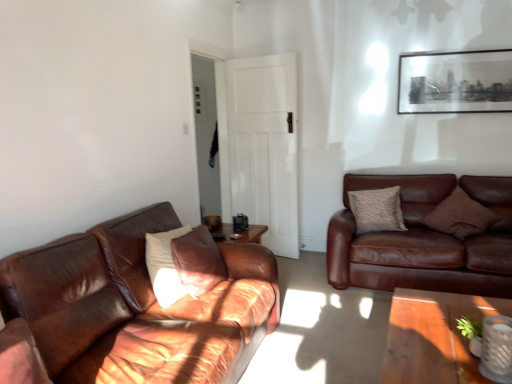
Question: Can you confirm if white matte pillow at left, the 1th pillow when ordered from front to back, is taller than white matte door at center?

Choices:
 (A) no
 (B) yes

Answer: (A)

Question: Can you confirm if white matte pillow at left, the 1th pillow when ordered from front to back, is positioned to the left of white matte door at center?

Choices:
 (A) yes
 (B) no

Answer: (A)

Question: Considering the relative sizes of white matte pillow at left, arranged as the first pillow when viewed from the left, and white matte door at center in the image provided, is white matte pillow at left, arranged as the first pillow when viewed from the left, smaller than white matte door at center?

Choices:
 (A) yes
 (B) no

Answer: (A)

Question: Can white matte door at center be found inside white matte pillow at left, the 3th pillow in the back-to-front sequence?

Choices:
 (A) no
 (B) yes

Answer: (A)

Question: Is white matte pillow at left, which is the third pillow in right-to-left order, not near white matte door at center?

Choices:
 (A) no
 (B) yes

Answer: (B)

Question: Does white matte pillow at left, the 1th pillow when ordered from front to back, turn towards white matte door at center?

Choices:
 (A) no
 (B) yes

Answer: (A)

Question: Considering the relative positions of brown textured pillow at right, the second pillow in the back-to-front sequence, and brown leather couch at left, the 2th studio couch viewed from the back, in the image provided, is brown textured pillow at right, the second pillow in the back-to-front sequence, to the right of brown leather couch at left, the 2th studio couch viewed from the back, from the viewer's perspective?

Choices:
 (A) no
 (B) yes

Answer: (B)

Question: Is brown textured pillow at right, which ranks as the second pillow in front-to-back order, to the left of brown leather couch at left, the 2th studio couch in the right-to-left sequence, from the viewer's perspective?

Choices:
 (A) yes
 (B) no

Answer: (B)

Question: Is brown leather couch at left, the 1th studio couch positioned from the left, a part of brown textured pillow at right, which ranks as the second pillow in front-to-back order?

Choices:
 (A) no
 (B) yes

Answer: (A)

Question: From the image's perspective, would you say brown textured pillow at right, which is the 3th pillow from left to right, is shown under brown leather couch at left, the 2th studio couch in the right-to-left sequence?

Choices:
 (A) no
 (B) yes

Answer: (A)

Question: Is brown textured pillow at right, which is the 3th pillow from left to right, far from brown leather couch at left, the 2th studio couch in the right-to-left sequence?

Choices:
 (A) yes
 (B) no

Answer: (A)

Question: Considering the relative sizes of brown textured pillow at right, which is the 3th pillow from left to right, and brown leather couch at left, the 2th studio couch in the right-to-left sequence, in the image provided, is brown textured pillow at right, which is the 3th pillow from left to right, thinner than brown leather couch at left, the 2th studio couch in the right-to-left sequence,?

Choices:
 (A) no
 (B) yes

Answer: (B)

Question: Is brown textured pillow at right, which ranks as the second pillow in front-to-back order, outside white matte door at center?

Choices:
 (A) yes
 (B) no

Answer: (A)